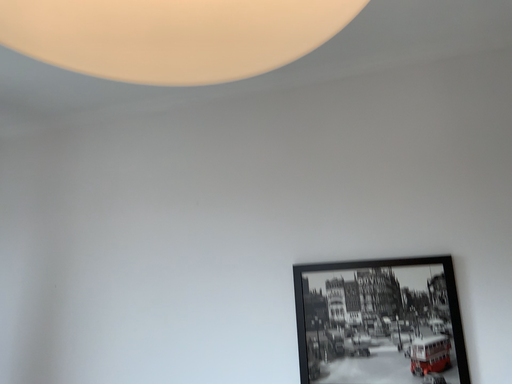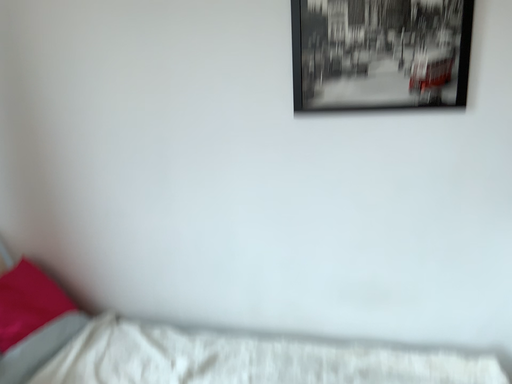
Question: How did the camera likely rotate when shooting the video?

Choices:
 (A) rotated downward
 (B) rotated upward

Answer: (A)